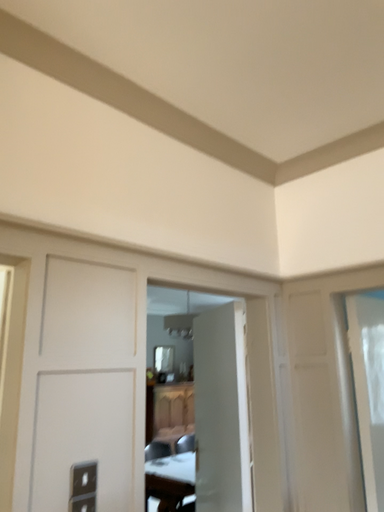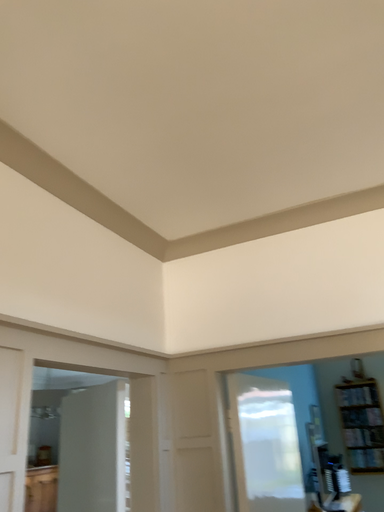
Question: Which way did the camera rotate in the video?

Choices:
 (A) rotated downward
 (B) rotated upward

Answer: (B)